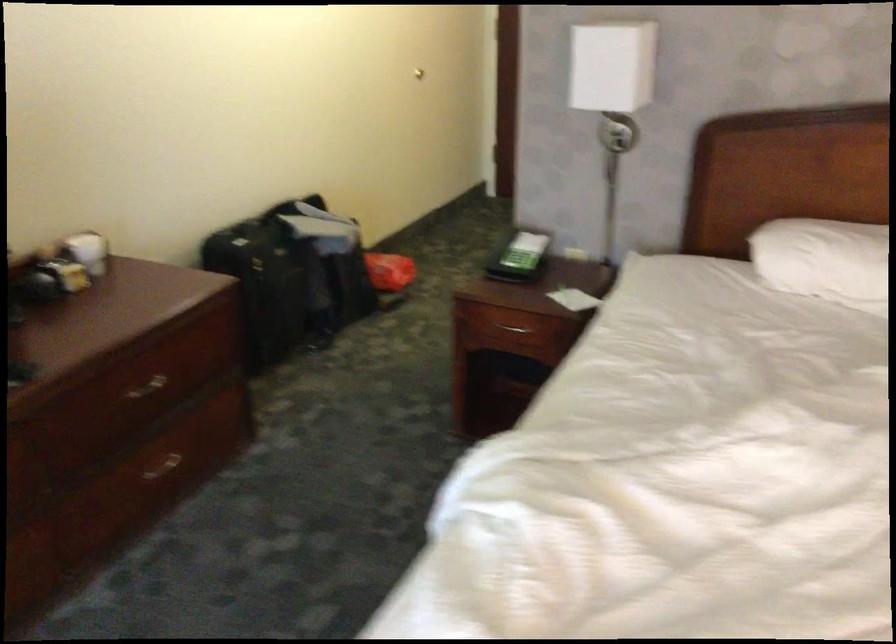
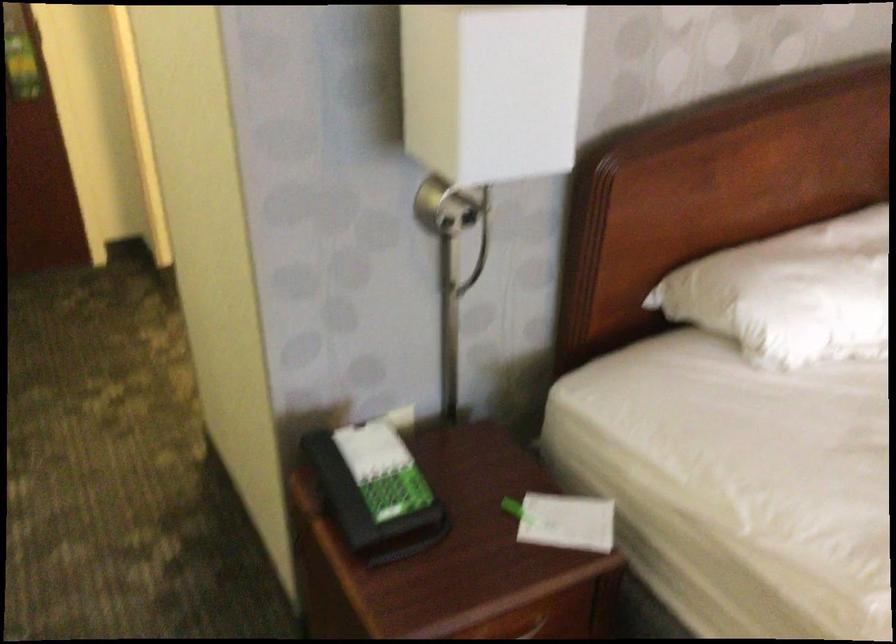
The point at (590,301) is marked in the first image. Where is the corresponding point in the second image?

(566, 522)